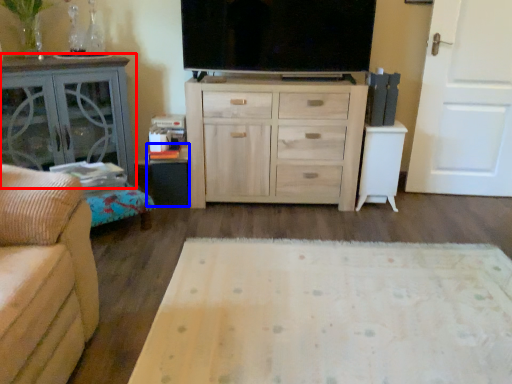
Question: Which object appears closest to the camera in this image, table (highlighted by a red box) or table (highlighted by a blue box)?

Choices:
 (A) table
 (B) table

Answer: (A)